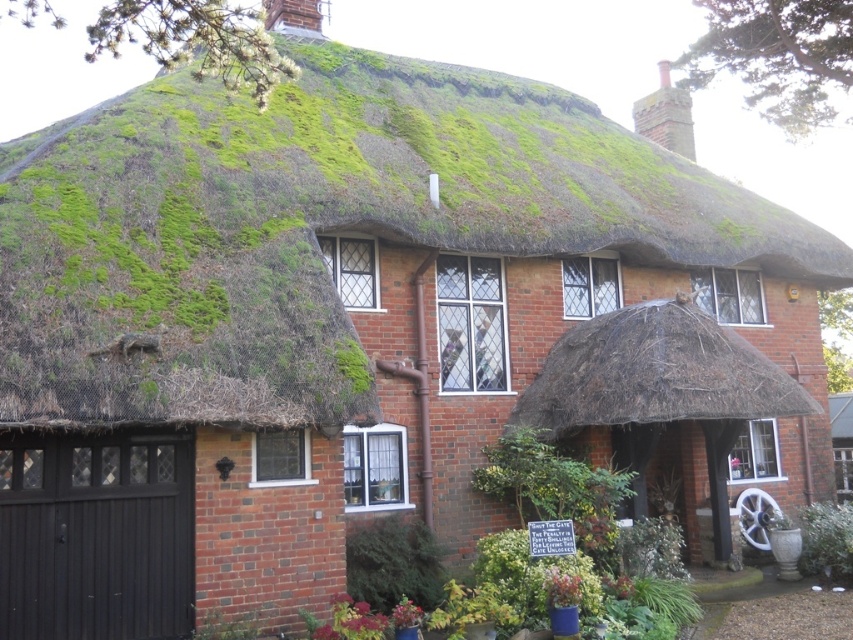
Question: Which point appears farthest from the camera in this image?

Choices:
 (A) (846, 540)
 (B) (637, 342)

Answer: (A)

Question: Among these points, which one is nearest to the camera?

Choices:
 (A) (837, 525)
 (B) (737, 397)

Answer: (B)

Question: Can you confirm if brown thatch roof at center is wider than green leafy plant at lower right?

Choices:
 (A) no
 (B) yes

Answer: (B)

Question: Considering the relative positions of brown thatch roof at center and green leafy plant at lower right in the image provided, where is brown thatch roof at center located with respect to green leafy plant at lower right?

Choices:
 (A) below
 (B) above

Answer: (B)

Question: Does brown thatch roof at center appear over green leafy plant at lower right?

Choices:
 (A) yes
 (B) no

Answer: (A)

Question: Which of the following is the closest to the observer?

Choices:
 (A) green leafy plant at lower right
 (B) brown thatch roof at center

Answer: (B)